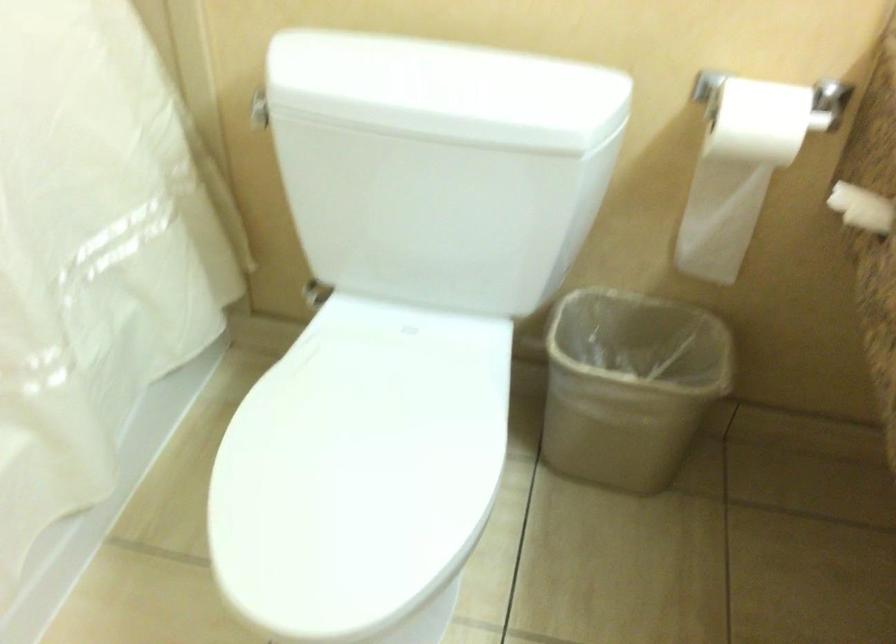
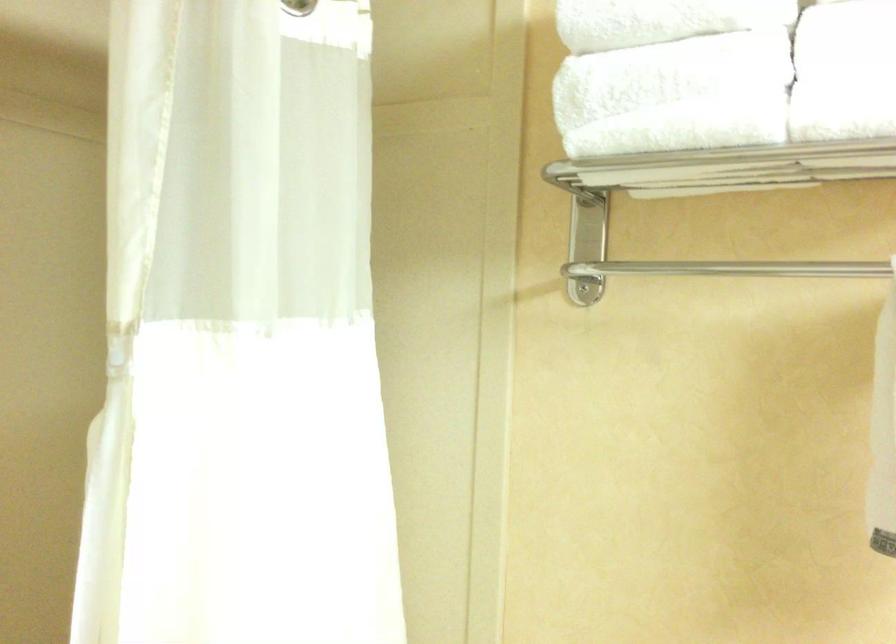
Based on the continuous images, in which direction is the camera rotating?

The camera's rotation is toward left-up.